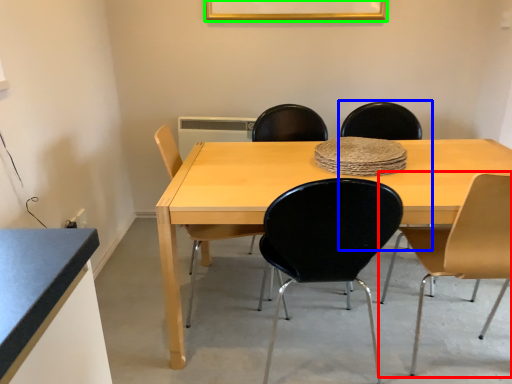
Question: Which object is the closest to the chair (highlighted by a red box)? Choose among these: chair (highlighted by a blue box) or picture frame (highlighted by a green box).

Choices:
 (A) chair
 (B) picture frame

Answer: (A)